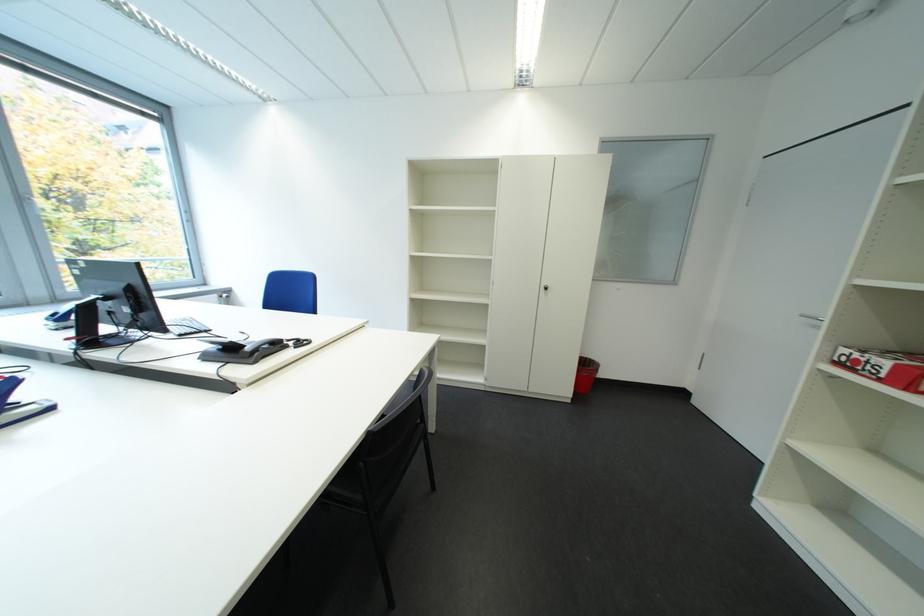
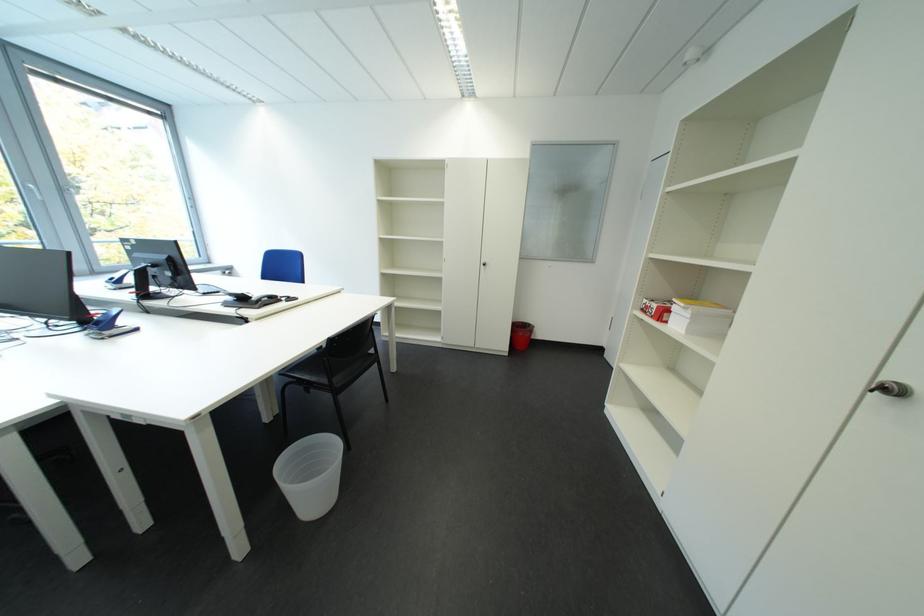
Question: Based on the continuous images, in which direction is the camera rotating? Reply with the corresponding letter.

Choices:
 (A) Left
 (B) Right
 (C) Up
 (D) Down

Answer: (D)